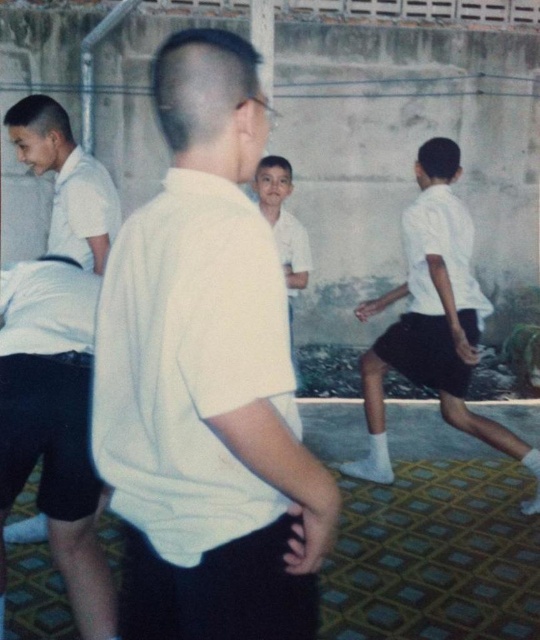
Question: Does white matte shirt at center have a lesser width compared to white matte shirt at right?

Choices:
 (A) yes
 (B) no

Answer: (A)

Question: Which point is closer to the camera?

Choices:
 (A) (271, 339)
 (B) (286, 237)

Answer: (A)

Question: Which of the following is the farthest from the observer?

Choices:
 (A) white smooth shirt at center
 (B) white matte shirt at center
 (C) white matte shirt at right

Answer: (A)

Question: Can you confirm if white matte shirt at center is wider than white smooth shirt at center?

Choices:
 (A) yes
 (B) no

Answer: (A)

Question: Which object is positioned farthest from the white matte shirt at right?

Choices:
 (A) white smooth shirt at center
 (B) white matte shirt at center

Answer: (B)

Question: Is white matte shirt at center in front of white smooth shirt at center?

Choices:
 (A) yes
 (B) no

Answer: (A)